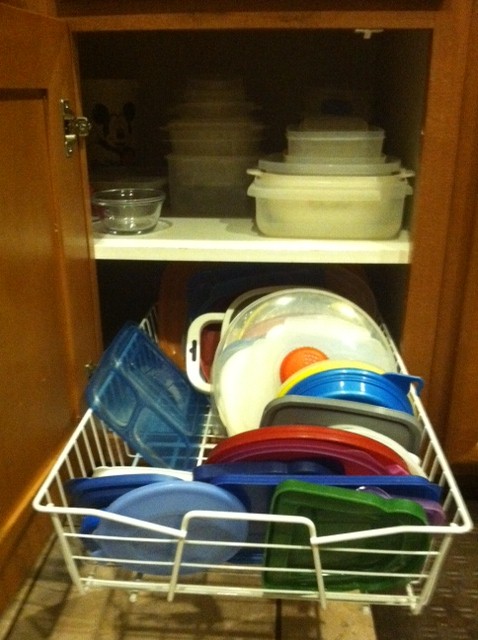
You are a GUI agent. You are given a task and a screenshot of the screen. Output one action in this format:
    pyautogui.click(x=<x>, y=<y>)
    Task: Click on the rug
    
    Given the screenshot: What is the action you would take?
    pyautogui.click(x=64, y=605)